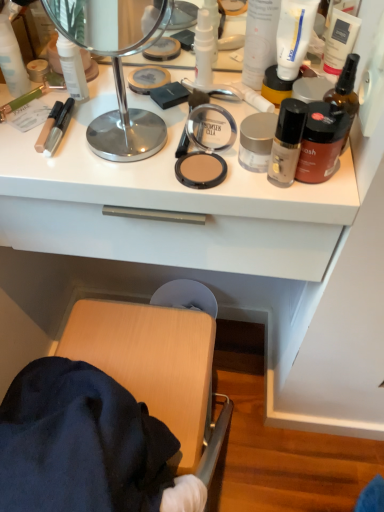
In order to click on free space above white matte countertop at upper center (from a real-world perspective) in this screenshot , I will do `click(133, 109)`.